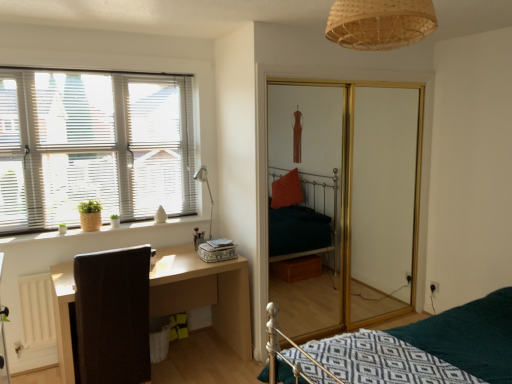
Question: Considering the positions of woven bamboo light fixture at upper center and gold-framed glass screen door at center in the image, is woven bamboo light fixture at upper center wider or thinner than gold-framed glass screen door at center?

Choices:
 (A) wide
 (B) thin

Answer: (A)

Question: Do you think woven bamboo light fixture at upper center is within gold-framed glass screen door at center, or outside of it?

Choices:
 (A) inside
 (B) outside

Answer: (B)

Question: Which is farther from the matte silver table lamp at upper left?

Choices:
 (A) woven bamboo light fixture at upper center
 (B) wooden window sill at left
 (C) light wood/dark brown desk at lower left
 (D) white blinds at left
 (E) brown leather swivel chair at left

Answer: (A)

Question: Based on their relative distances, which object is farther from the white blinds at left?

Choices:
 (A) gold-framed glass screen door at center
 (B) brown leather swivel chair at left
 (C) matte silver table lamp at upper left
 (D) light wood/dark brown desk at lower left
 (E) woven bamboo light fixture at upper center

Answer: (E)